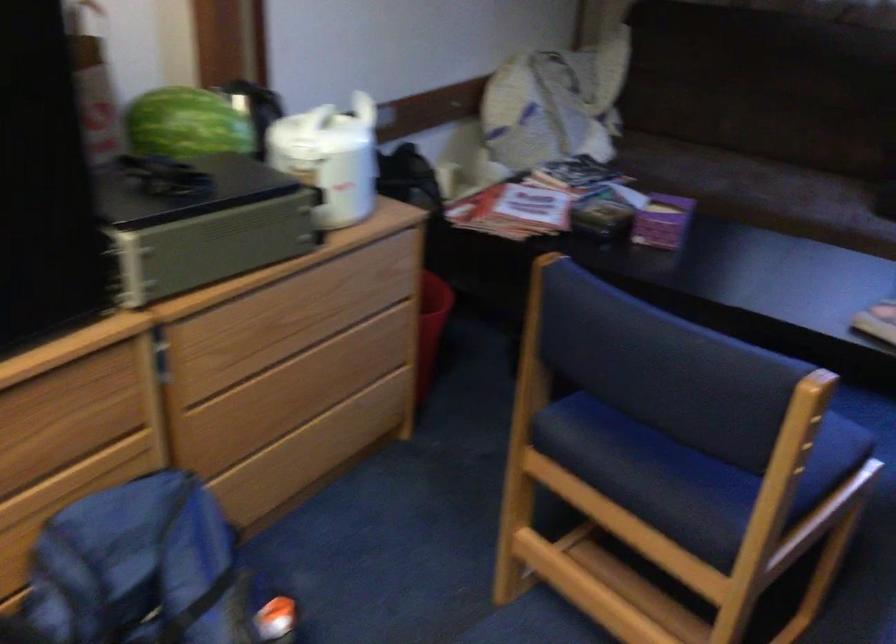
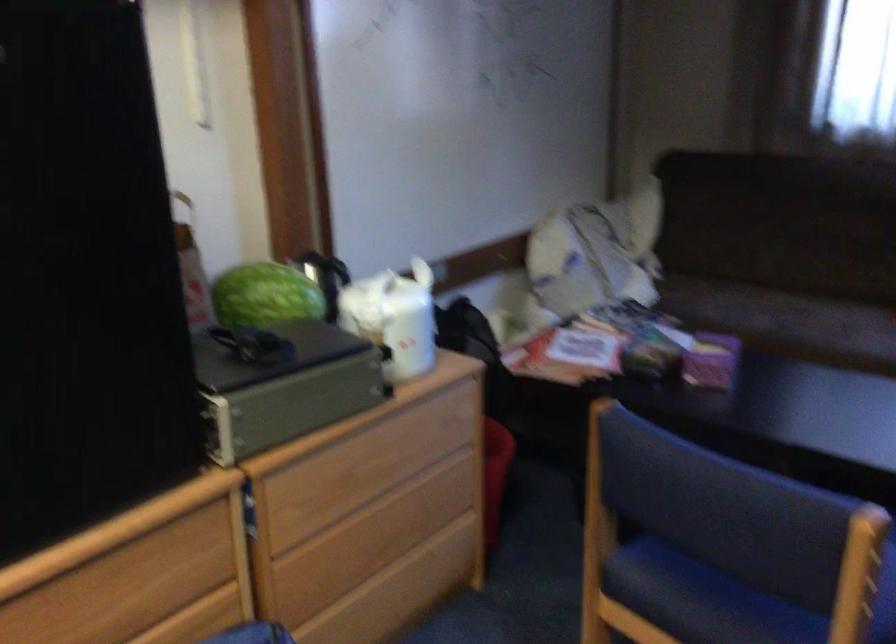
Find the pixel in the second image that matches (298,303) in the first image.

(373, 457)